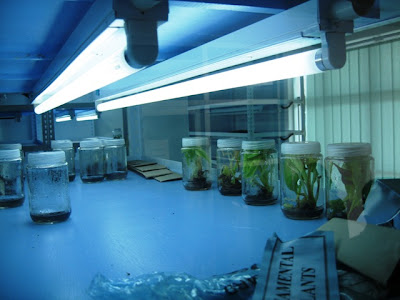
Locate an element on the screen. This screenshot has height=300, width=400. wall is located at coordinates (8, 134), (71, 131), (116, 122), (159, 123).